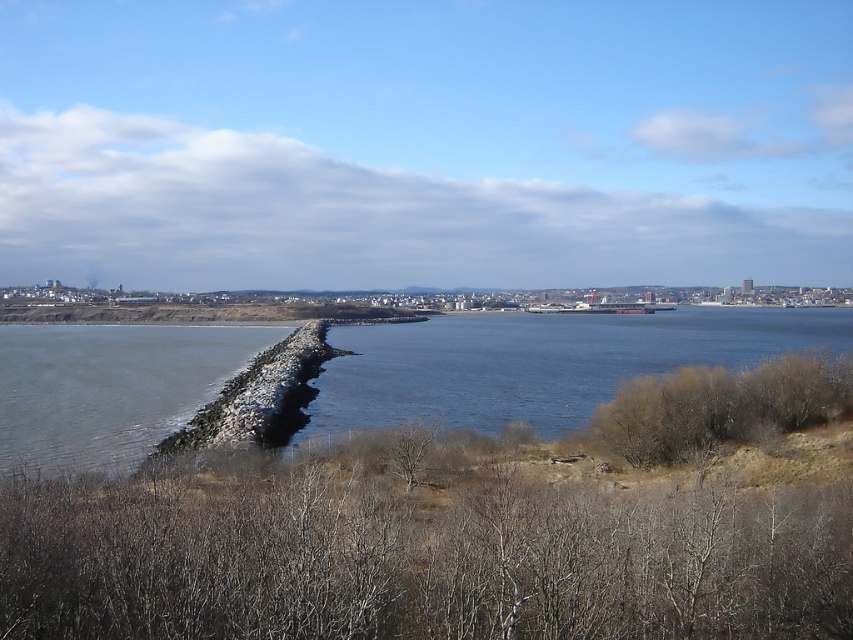
Question: Is rocky jetty at lower left below brown dry bush at lower right?

Choices:
 (A) yes
 (B) no

Answer: (B)

Question: Which point is closer to the camera?

Choices:
 (A) (195, 371)
 (B) (844, 404)

Answer: (B)

Question: Which object appears closest to the camera in this image?

Choices:
 (A) brown dry bush at lower right
 (B) rocky jetty at lower left

Answer: (B)

Question: Which object is positioned farthest from the rocky jetty at lower left?

Choices:
 (A) dark gray concrete waterway at center
 (B) brown dry bush at lower right

Answer: (B)

Question: Observing the image, what is the correct spatial positioning of dark gray concrete waterway at center in reference to rocky jetty at lower left?

Choices:
 (A) right
 (B) left

Answer: (A)

Question: Does rocky jetty at lower left appear on the right side of brown dry bush at lower right?

Choices:
 (A) no
 (B) yes

Answer: (A)